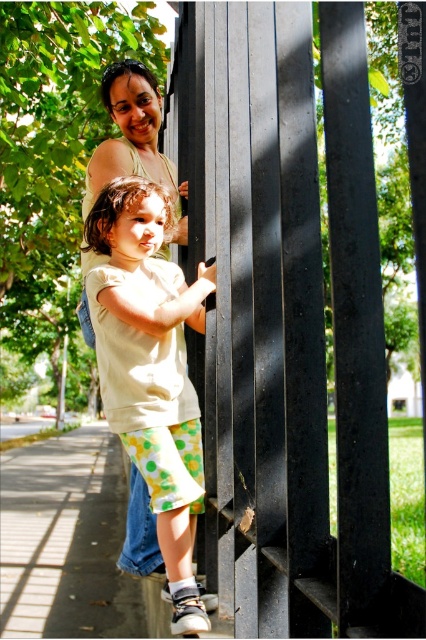
You are a photographer trying to capture a photo of the black matte fence at upper center and the matte green tank top at upper center. You want to ensure that both subjects are fully visible in the frame. Which object should you adjust your camera angle to prioritize if the fence is wider than the tank top?

The black matte fence at upper center is wider than the matte green tank top at upper center. To ensure both are fully visible, prioritize adjusting the camera angle to accommodate the wider black matte fence at upper center first.

You are a photographer trying to capture a candid shot of the woman and child. You notice the black matte fence at upper center and the matte green tank top at upper center in your viewfinder. Which object should you position to the left side of your frame to ensure the woman and child are centered?

You should position the black matte fence at upper center to the left side of your frame because it is already to the right of the matte green tank top at upper center, which is part of the woman. Centering the matte green tank top at upper center would place the woman and child in the center while moving the fence to the left.

You are a photographer trying to capture a photo of the gray asphalt pavement at lower left and the matte green tank top at upper center. Which object is located lower in the image?

The gray asphalt pavement at lower left is positioned under the matte green tank top at upper center, so the gray asphalt pavement at lower left is located lower in the image.